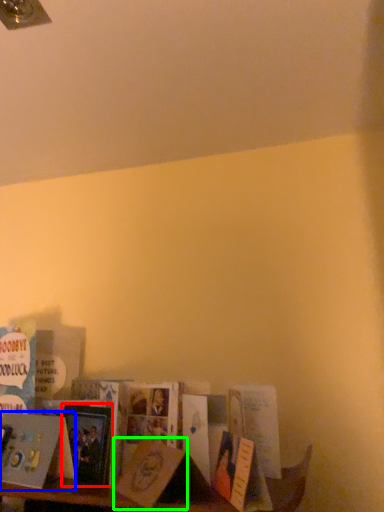
Question: Which is farther away from paperback book (highlighted by a red box)? book (highlighted by a blue box) or paperback book (highlighted by a green box)?

Choices:
 (A) book
 (B) paperback book

Answer: (B)